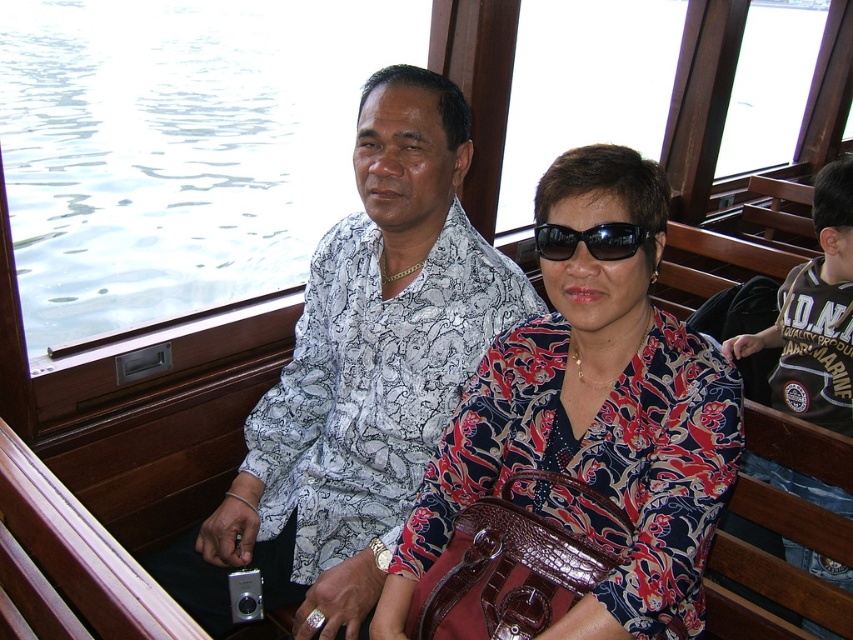
Question: Observing the image, what is the correct spatial positioning of white printed shirt at center in reference to silver metallic camera at lower left?

Choices:
 (A) below
 (B) above

Answer: (B)

Question: Can you confirm if silver metallic camera at lower left is smaller than black plastic sunglasses at center?

Choices:
 (A) no
 (B) yes

Answer: (A)

Question: Which of the following is the farthest from the observer?

Choices:
 (A) (611, 250)
 (B) (325, 433)

Answer: (B)

Question: Which of the following is the closest to the observer?

Choices:
 (A) (189, 580)
 (B) (595, 388)

Answer: (B)

Question: Which point is farther to the camera?

Choices:
 (A) floral-patterned fabric at center
 (B) white printed shirt at center

Answer: (B)

Question: Does white printed shirt at center appear on the left side of silver metallic camera at lower left?

Choices:
 (A) no
 (B) yes

Answer: (A)